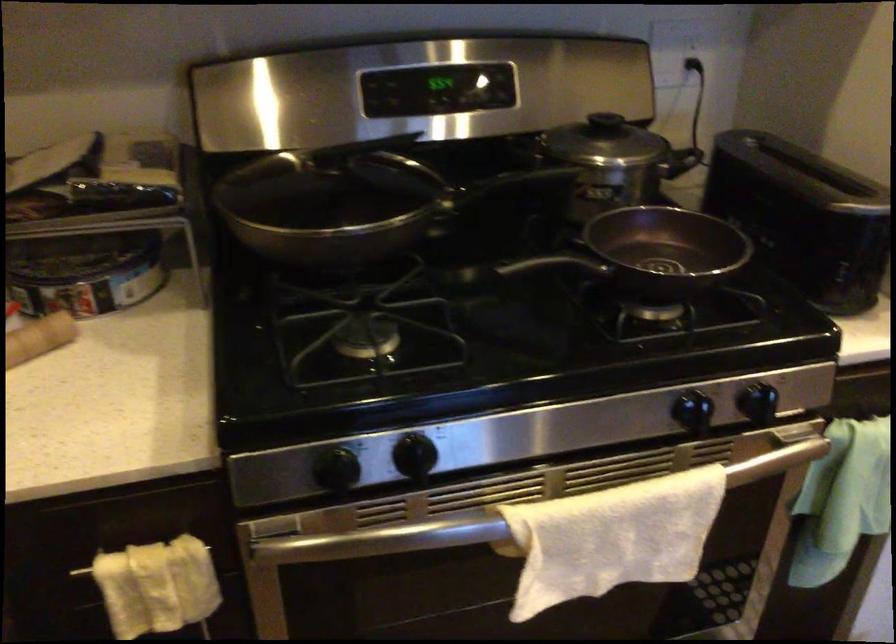
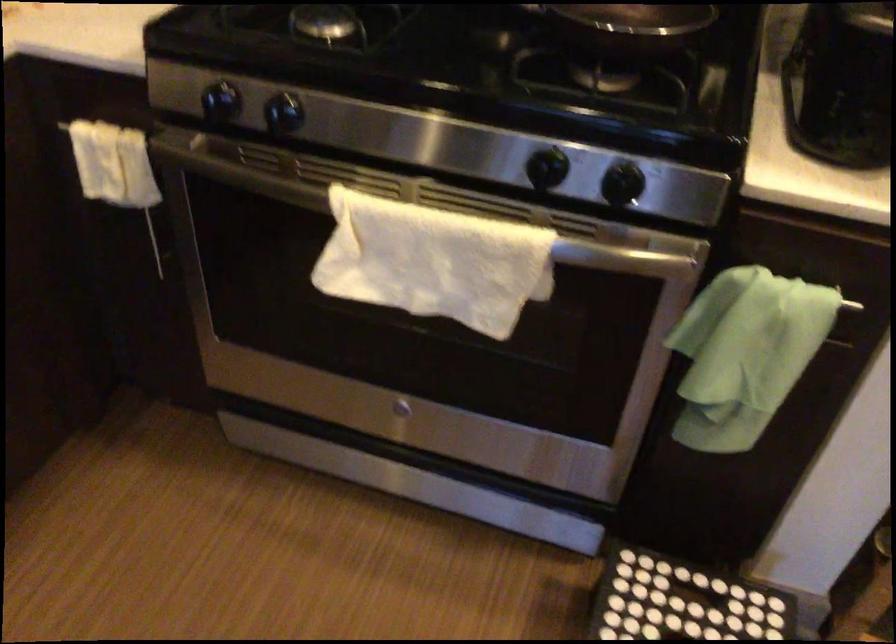
Question: How did the camera likely rotate?

Choices:
 (A) Left
 (B) Right
 (C) Up
 (D) Down

Answer: (A)